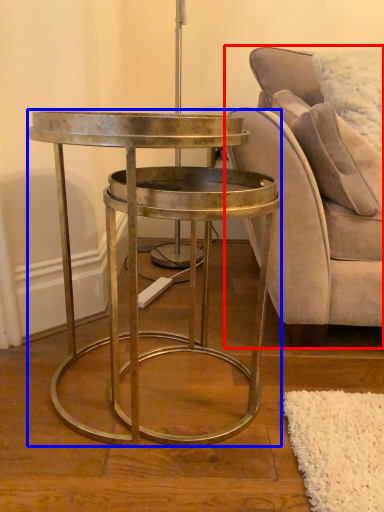
Question: Which of the following is the closest to the observer, chair (highlighted by a red box) or table (highlighted by a blue box)?

Choices:
 (A) chair
 (B) table

Answer: (B)